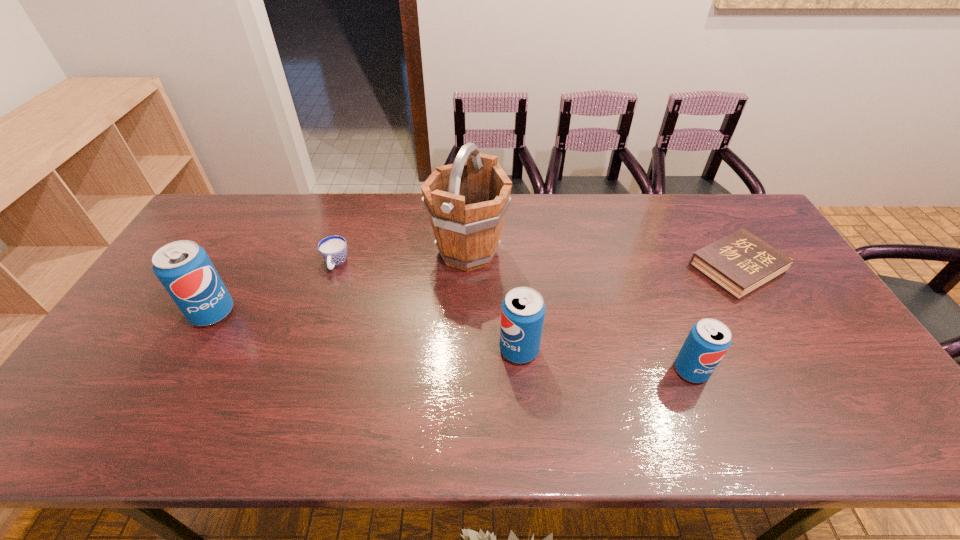
This screenshot has width=960, height=540. In order to click on hardback book in this screenshot , I will do `click(739, 263)`.

Image resolution: width=960 pixels, height=540 pixels. Identify the location of vacant point located 0.130m on the right of the leftmost soda can. (280, 313).

You are a GUI agent. You are given a task and a screenshot of the screen. Output one action in this format:
    pyautogui.click(x=<x>, y=<y>)
    Task: Click on the vacant space located 0.090m on the back of the third tallest object
    This screenshot has height=540, width=960.
    Given the screenshot: What is the action you would take?
    pyautogui.click(x=516, y=308)

The height and width of the screenshot is (540, 960). I want to click on free spot located on the right of the shortest soda can, so click(845, 370).

You are a GUI agent. You are given a task and a screenshot of the screen. Output one action in this format:
    pyautogui.click(x=<x>, y=<y>)
    Task: Click on the free space located on the side of the fifth object from right to left with the handle
    This screenshot has height=540, width=960.
    Given the screenshot: What is the action you would take?
    pyautogui.click(x=319, y=314)

The height and width of the screenshot is (540, 960). What are the coordinates of `free space located on the front of the tallest object` in the screenshot? It's located at (466, 328).

Locate an element on the screen. blank area located 0.130m on the front of the shortest object is located at coordinates (779, 338).

The height and width of the screenshot is (540, 960). I want to click on object located at the far edge, so click(466, 203).

Where is `object that is positioned at the near edge`? The image size is (960, 540). object that is positioned at the near edge is located at coordinates [709, 339].

Locate an element on the screen. Image resolution: width=960 pixels, height=540 pixels. object that is at the left edge is located at coordinates (183, 267).